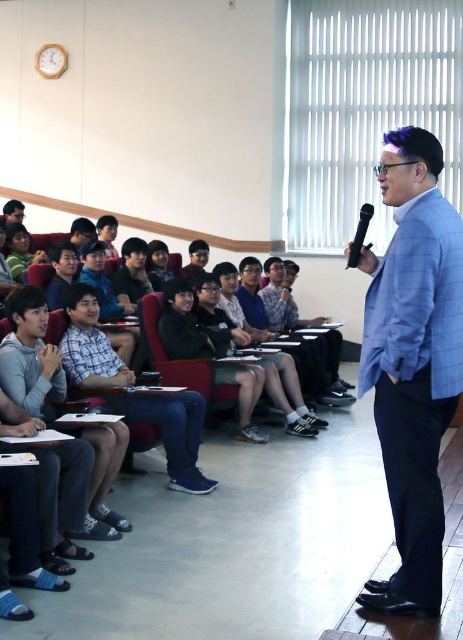
Does blue fabric jacket at upper right appear over black plastic microphone at center?

No.

Which is in front, point (319, 358) or point (356, 259)?

Positioned in front is point (356, 259).

The height and width of the screenshot is (640, 463). Find the location of `blue fabric jacket at upper right`. blue fabric jacket at upper right is located at coordinates (281, 300).

Is point (72, 314) less distant than point (363, 204)?

No, (72, 314) is further to viewer.

This screenshot has height=640, width=463. What are the coordinates of `blue casual shirt at center` in the screenshot? It's located at (173, 433).

Is point (179, 468) positioned before point (357, 257)?

No, (179, 468) is behind (357, 257).

You are a GUI agent. You are given a task and a screenshot of the screen. Output one action in this format:
    pyautogui.click(x=<x>, y=<y>)
    Task: Click on the blue casual shirt at center
    
    Given the screenshot: What is the action you would take?
    pyautogui.click(x=173, y=433)

Is blue plaid blazer at center thinner than blue fabric jacket at upper right?

Correct, blue plaid blazer at center's width is less than blue fabric jacket at upper right's.

Is blue plaid blazer at center shorter than blue fabric jacket at upper right?

In fact, blue plaid blazer at center may be taller than blue fabric jacket at upper right.

Describe the element at coordinates (412, 362) in the screenshot. Image resolution: width=463 pixels, height=640 pixels. I see `blue plaid blazer at center` at that location.

I want to click on blue plaid blazer at center, so click(x=412, y=362).